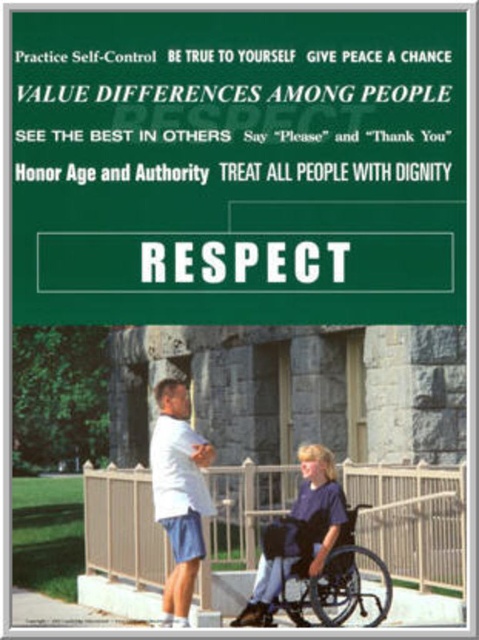
Question: Among these objects, which one is nearest to the camera?

Choices:
 (A) blue fabric wheelchair at lower center
 (B) green paper sign at center
 (C) white matte shirt at center

Answer: (A)

Question: Which of these objects is positioned closest to the blue fabric wheelchair at lower center?

Choices:
 (A) green paper sign at center
 (B) black plastic wheelchair at lower center

Answer: (B)

Question: Is green paper sign at center to the right of blue fabric wheelchair at lower center from the viewer's perspective?

Choices:
 (A) yes
 (B) no

Answer: (B)

Question: Which point is closer to the camera?

Choices:
 (A) white matte shirt at center
 (B) black plastic wheelchair at lower center
 (C) blue fabric wheelchair at lower center

Answer: (B)

Question: Is green paper sign at center behind blue fabric wheelchair at lower center?

Choices:
 (A) no
 (B) yes

Answer: (B)

Question: Does green paper sign at center have a lesser width compared to black plastic wheelchair at lower center?

Choices:
 (A) yes
 (B) no

Answer: (B)